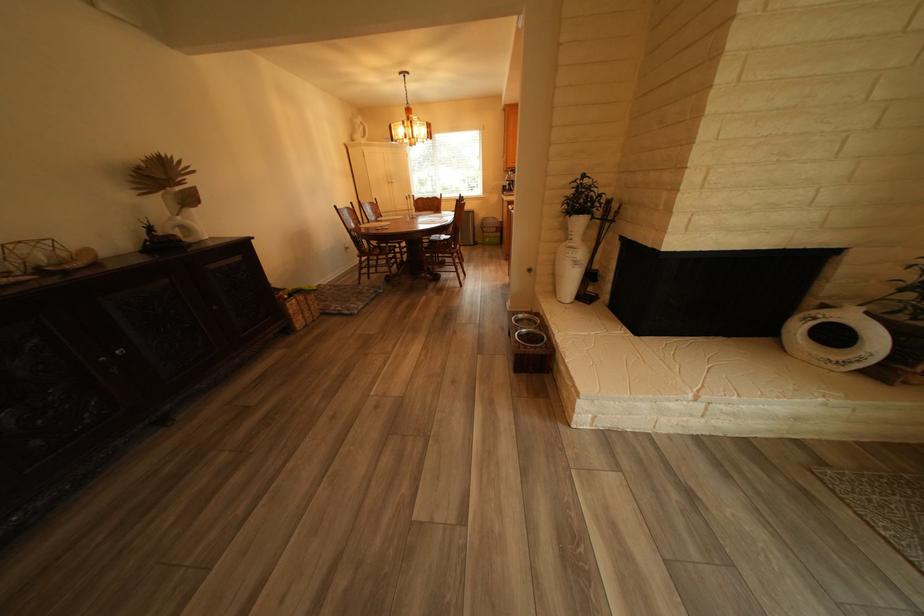
Find where to grip the fireplace tool handle. Please return your answer as a coordinate pair (x, y).

(606, 281)